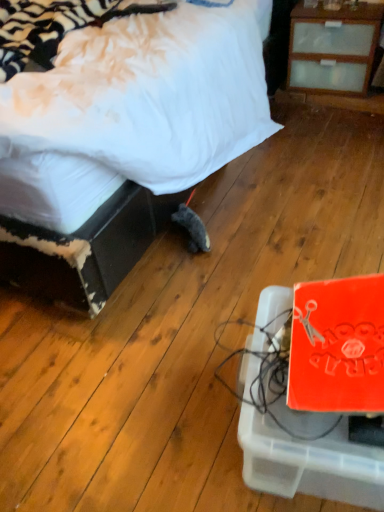
Question: Is white soft bed at center further to the viewer compared to orange matte cardboard box at lower right?

Choices:
 (A) no
 (B) yes

Answer: (B)

Question: Is white soft bed at center placed right next to orange matte cardboard box at lower right?

Choices:
 (A) yes
 (B) no

Answer: (B)

Question: Considering the relative sizes of white soft bed at center and orange matte cardboard box at lower right in the image provided, is white soft bed at center shorter than orange matte cardboard box at lower right?

Choices:
 (A) yes
 (B) no

Answer: (B)

Question: Is white soft bed at center to the left of orange matte cardboard box at lower right from the viewer's perspective?

Choices:
 (A) yes
 (B) no

Answer: (A)

Question: Is orange matte cardboard box at lower right a part of white soft bed at center?

Choices:
 (A) no
 (B) yes

Answer: (A)

Question: Considering the relative sizes of white soft bed at center and orange matte cardboard box at lower right in the image provided, is white soft bed at center taller than orange matte cardboard box at lower right?

Choices:
 (A) yes
 (B) no

Answer: (A)

Question: Is orange matte cardboard box at lower right positioned beyond the bounds of white soft bed at center?

Choices:
 (A) no
 (B) yes

Answer: (B)

Question: Can you confirm if orange matte cardboard box at lower right is bigger than white soft bed at center?

Choices:
 (A) no
 (B) yes

Answer: (A)

Question: Is orange matte cardboard box at lower right at the left side of white soft bed at center?

Choices:
 (A) yes
 (B) no

Answer: (B)

Question: Does orange matte cardboard box at lower right contain white soft bed at center?

Choices:
 (A) yes
 (B) no

Answer: (B)

Question: Is orange matte cardboard box at lower right looking in the opposite direction of white soft bed at center?

Choices:
 (A) no
 (B) yes

Answer: (A)

Question: Is orange matte cardboard box at lower right wider than white soft bed at center?

Choices:
 (A) yes
 (B) no

Answer: (B)

Question: Is white soft bed at center to the left or to the right of orange matte cardboard box at lower right in the image?

Choices:
 (A) left
 (B) right

Answer: (A)